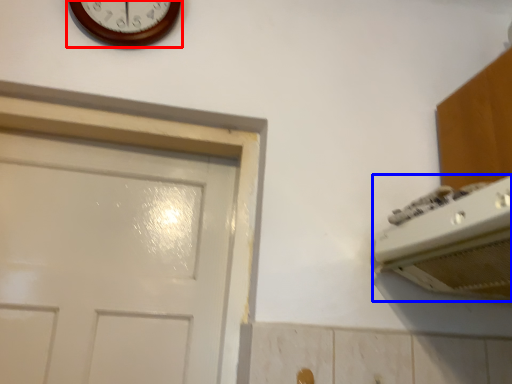
Question: Which object is closer to the camera taking this photo, wall clock (highlighted by a red box) or appliance (highlighted by a blue box)?

Choices:
 (A) wall clock
 (B) appliance

Answer: (B)